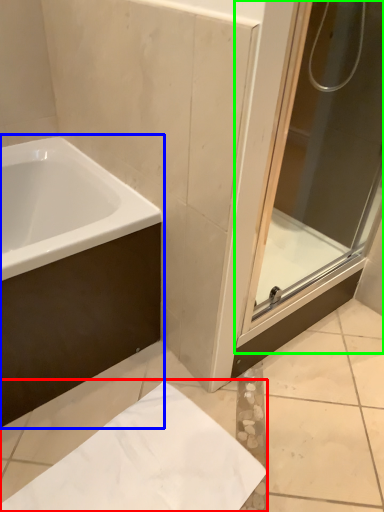
Question: Estimate the real-world distances between objects in this image. Which object is farther from paper (highlighted by a red box), bathtub (highlighted by a blue box) or screen door (highlighted by a green box)?

Choices:
 (A) bathtub
 (B) screen door

Answer: (B)